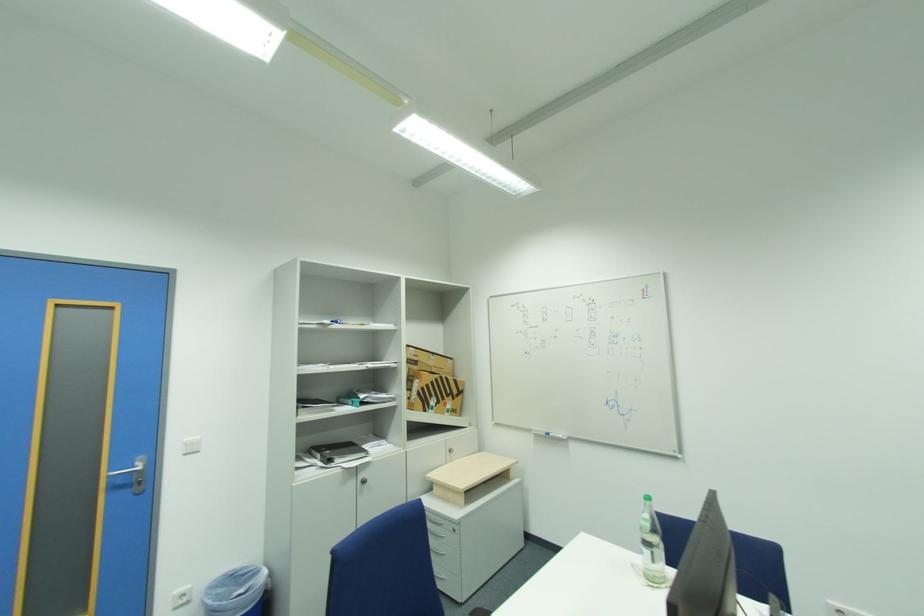
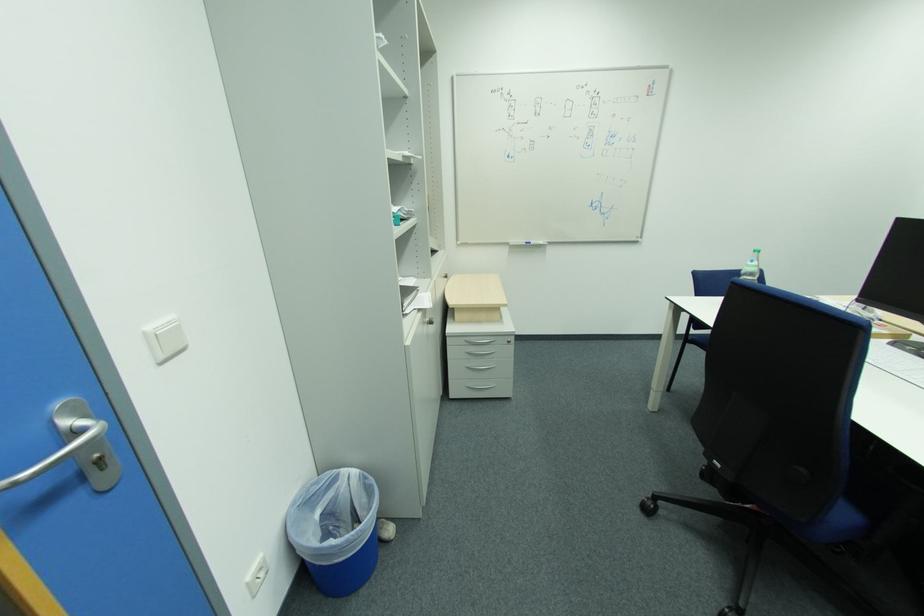
The point at (x=565, y=437) is marked in the first image. Where is the corresponding point in the second image?

(546, 244)